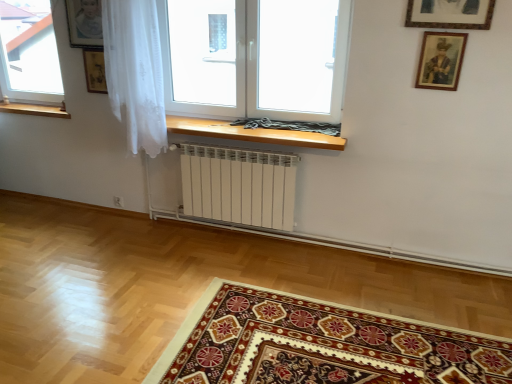
Question: Which direction should I rotate to look at transparent glass window at center, the first window positioned from the right, — up or down?

Choices:
 (A) up
 (B) down

Answer: (A)

Question: Is transparent glass window at center, the second window positioned from the left, next to carpet with intricate patterns at lower center?

Choices:
 (A) no
 (B) yes

Answer: (A)

Question: Is transparent glass window at center, the first window positioned from the right, looking in the opposite direction of carpet with intricate patterns at lower center?

Choices:
 (A) no
 (B) yes

Answer: (A)

Question: From the image's perspective, would you say transparent glass window at center, the first window positioned from the right, is positioned over carpet with intricate patterns at lower center?

Choices:
 (A) no
 (B) yes

Answer: (B)

Question: Considering the relative positions of transparent glass window at center, the second window positioned from the left, and carpet with intricate patterns at lower center in the image provided, is transparent glass window at center, the second window positioned from the left, in front of carpet with intricate patterns at lower center?

Choices:
 (A) no
 (B) yes

Answer: (A)

Question: Is transparent glass window at center, the first window positioned from the right, far away from carpet with intricate patterns at lower center?

Choices:
 (A) yes
 (B) no

Answer: (A)

Question: Considering the relative sizes of transparent glass window at center, the first window positioned from the right, and carpet with intricate patterns at lower center in the image provided, is transparent glass window at center, the first window positioned from the right, thinner than carpet with intricate patterns at lower center?

Choices:
 (A) no
 (B) yes

Answer: (B)

Question: From a real-world perspective, is transparent glass window at upper left, the 1th window from the left, physically below transparent glass window at center, the first window positioned from the right?

Choices:
 (A) no
 (B) yes

Answer: (B)

Question: From the image's perspective, is transparent glass window at upper left, arranged as the second window when viewed from the right, beneath transparent glass window at center, the first window positioned from the right?

Choices:
 (A) no
 (B) yes

Answer: (A)

Question: Is transparent glass window at center, the second window positioned from the left, located within transparent glass window at upper left, the 1th window from the left?

Choices:
 (A) no
 (B) yes

Answer: (A)

Question: Considering the relative positions of transparent glass window at upper left, arranged as the second window when viewed from the right, and transparent glass window at center, the first window positioned from the right, in the image provided, is transparent glass window at upper left, arranged as the second window when viewed from the right, to the right of transparent glass window at center, the first window positioned from the right, from the viewer's perspective?

Choices:
 (A) no
 (B) yes

Answer: (A)

Question: Is transparent glass window at upper left, arranged as the second window when viewed from the right, positioned with its back to transparent glass window at center, the first window positioned from the right?

Choices:
 (A) no
 (B) yes

Answer: (A)

Question: Is transparent glass window at upper left, the 1th window from the left, facing towards transparent glass window at center, the second window positioned from the left?

Choices:
 (A) no
 (B) yes

Answer: (A)

Question: Is transparent glass window at center, the second window positioned from the left, far away from transparent glass window at upper left, arranged as the second window when viewed from the right?

Choices:
 (A) yes
 (B) no

Answer: (A)